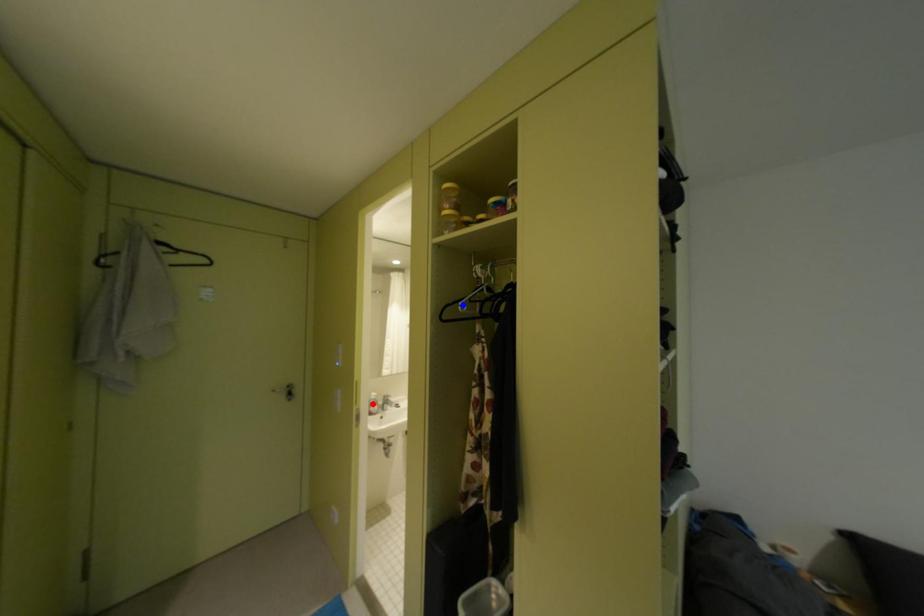
Question: Which of the two points in the image is closer to the camera?

Choices:
 (A) Blue point is closer.
 (B) Red point is closer.

Answer: (A)